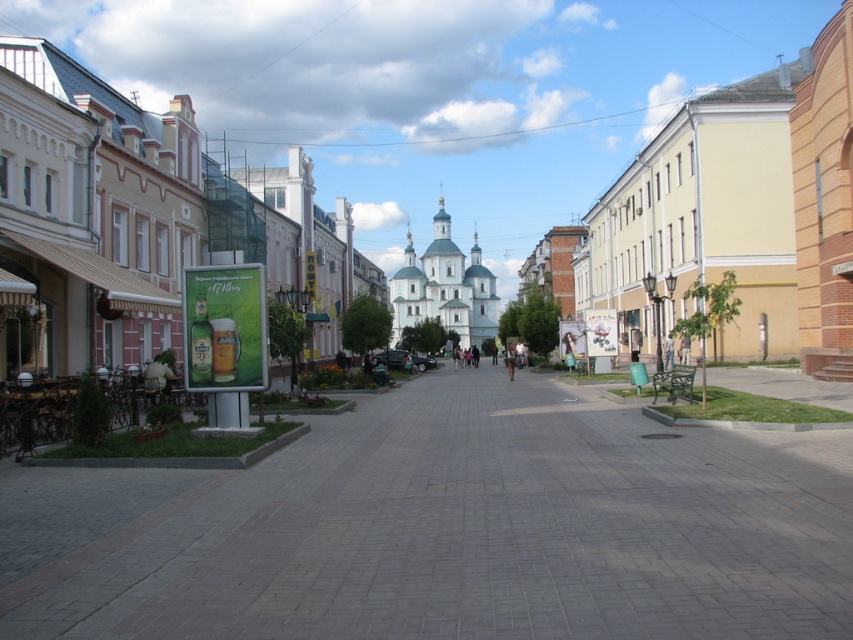
Question: Which of the following is the farthest from the observer?

Choices:
 (A) denim pants at center
 (B) white stone church at center
 (C) dark blue jeans at center
 (D) brown leather jacket at center

Answer: (C)

Question: Which object appears closest to the camera in this image?

Choices:
 (A) denim pants at center
 (B) white stone church at center

Answer: (A)

Question: Is denim pants at center further to the viewer compared to brown leather jacket at center?

Choices:
 (A) yes
 (B) no

Answer: (B)

Question: Which of the following is the closest to the observer?

Choices:
 (A) (494, 352)
 (B) (672, 342)
 (C) (503, 353)

Answer: (B)

Question: Does denim pants at center have a greater width compared to brown leather jacket at center?

Choices:
 (A) no
 (B) yes

Answer: (A)

Question: Is denim pants at center wider than brown leather jacket at center?

Choices:
 (A) yes
 (B) no

Answer: (B)